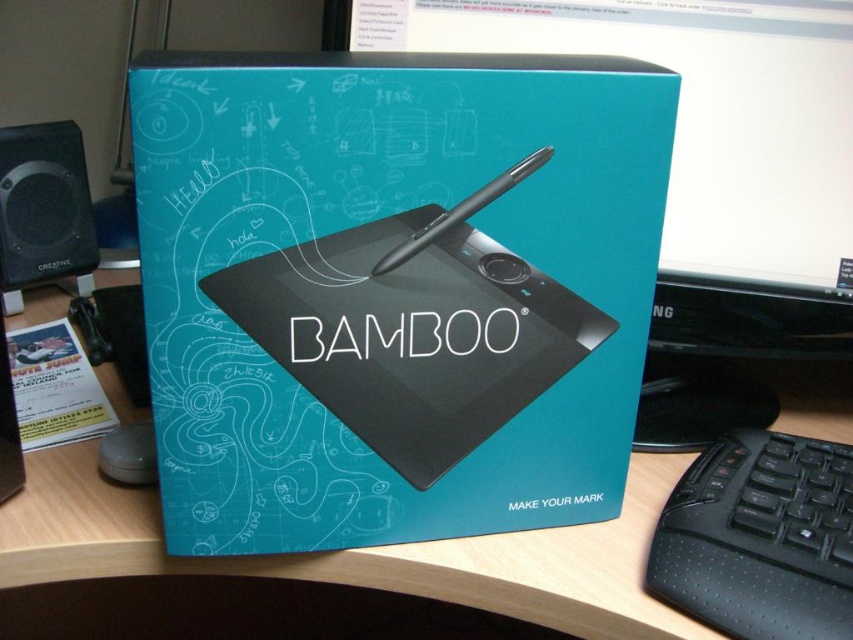
You are designing a display for a store and need to place a decorative item on top of the wooden at center and the black matte pen at center. Which object can you place the item on so it will not fall off?

The wooden at center is taller than the black matte pen at center, so placing the decorative item on the wooden at center would be more stable and less likely to fall off.

You are organizing a desk and need to place both the black rubberized keyboard at lower right and the white paper flyer at lower left. Which object should you place first if you want to ensure the larger item is visible?

You should place the white paper flyer at lower left first because it is larger than the black rubberized keyboard at lower right, ensuring the larger item remains visible.